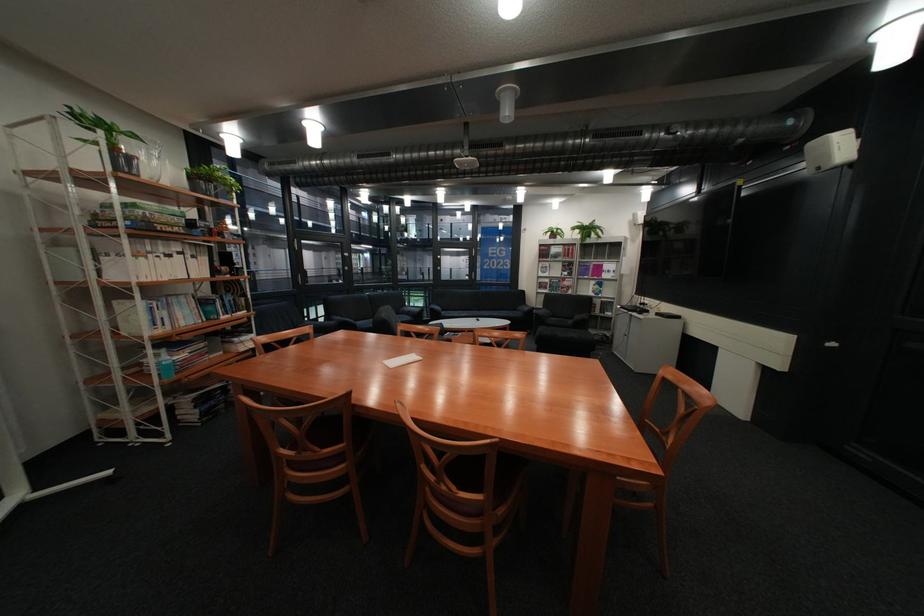
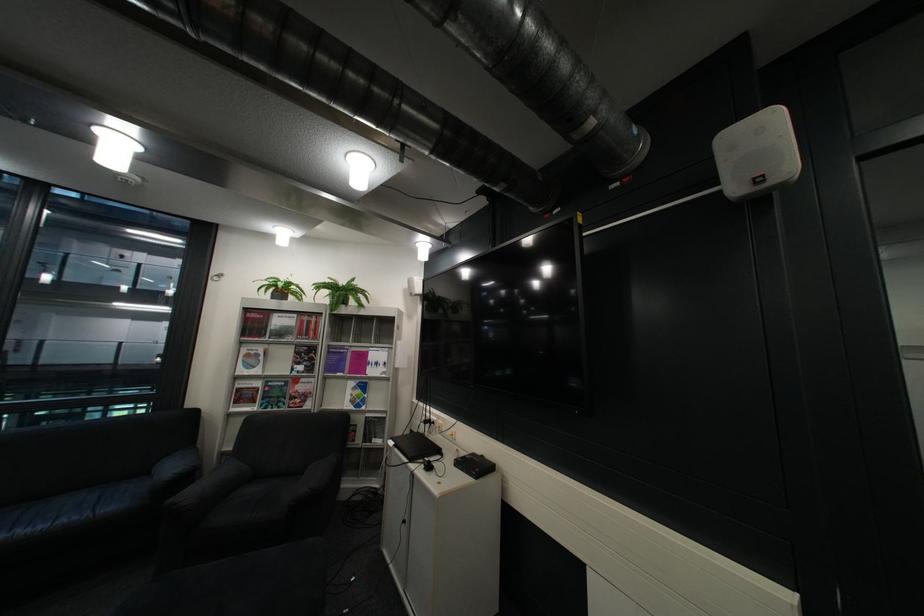
Where in the second image is the point corresponding to the point at 624,314 from the first image?

(393, 442)